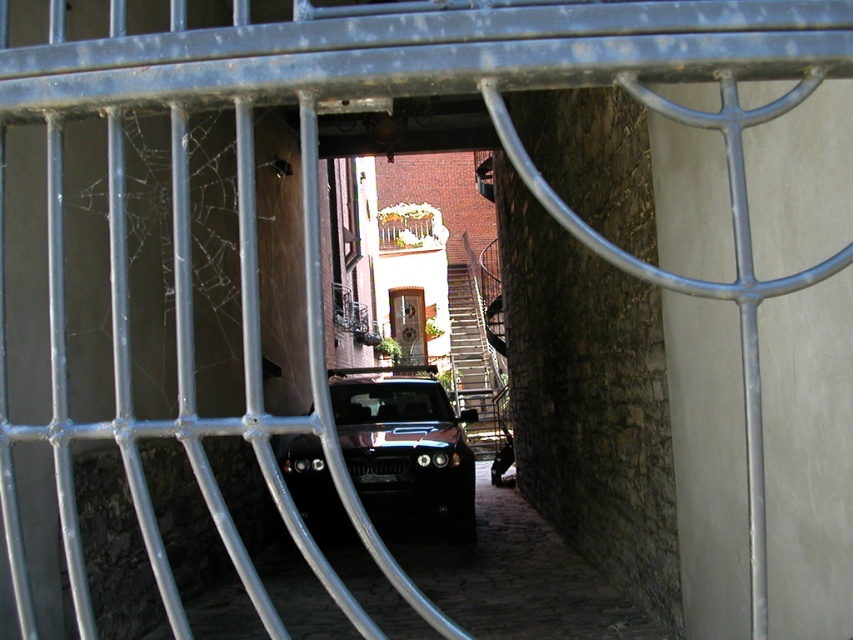
You are driving a glossy black jeep at center and need to pass through the wooden door at center. Based on the scene description, will the jeep fit through the door?

The glossy black jeep at center is wider than the wooden door at center, so the jeep will not fit through the door.

You are driving a glossy black jeep at center and need to exit the alleyway. The alleyway is narrow, and the metallic silver stairs at center are in your path. Can you safely navigate around the stairs to exit the alleyway?

The glossy black jeep at center is in front of the metallic silver stairs at center, meaning the jeep is blocking the stairs. To exit the alleyway, you can drive forward past the stairs since the jeep is already positioned in front of them, allowing a clear path forward.